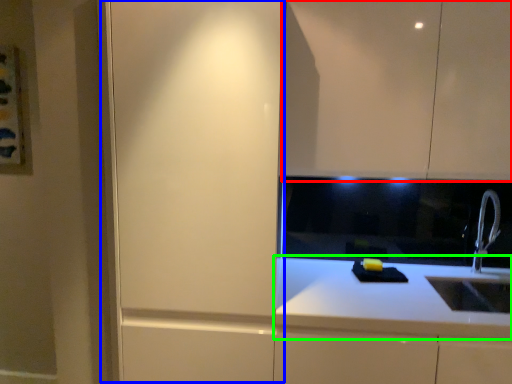
Question: Which object is positioned farthest from cabinetry (highlighted by a red box)? Select from screen door (highlighted by a blue box) and countertop (highlighted by a green box).

Choices:
 (A) screen door
 (B) countertop

Answer: (B)